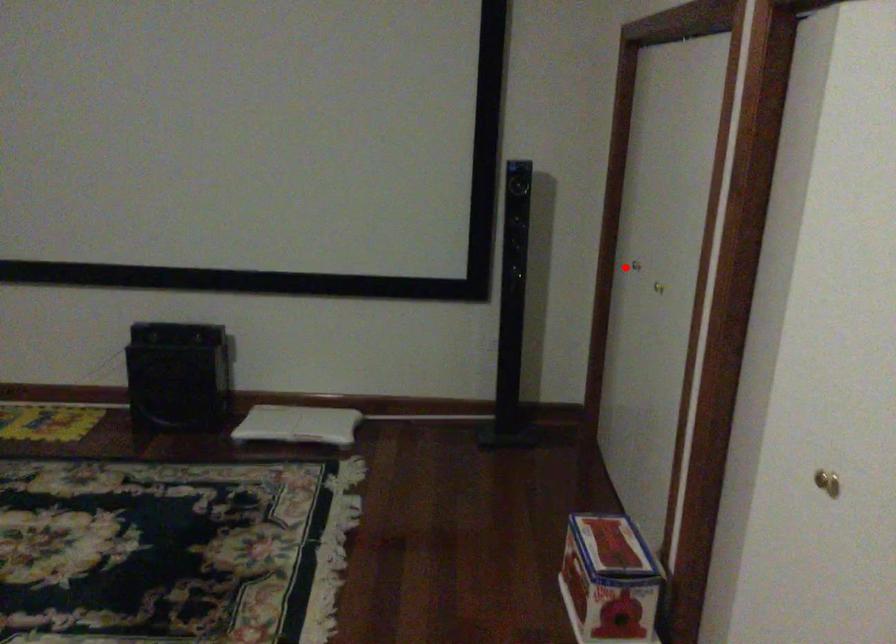
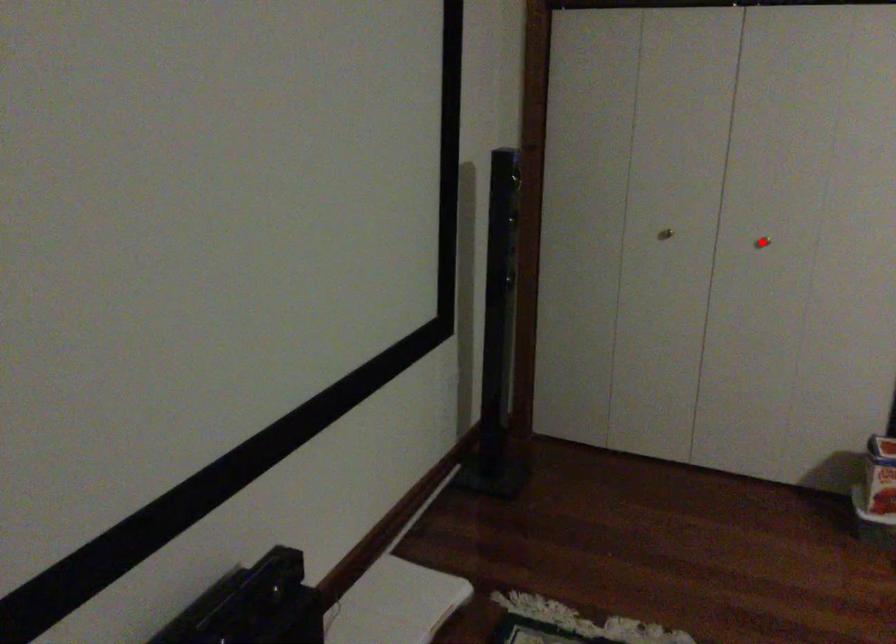
I am providing you with two images of the same scene from different viewpoints. A red point is marked on the first image and another point is marked on the second image. Do the highlighted points in image1 and image2 indicate the same real-world spot?

No